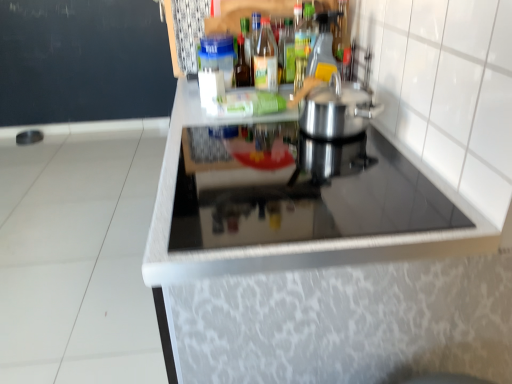
This screenshot has height=384, width=512. What are the coordinates of `vacant space to the left of clear glass bottle at upper center, which ranks as the third bottle in left-to-right order` in the screenshot? It's located at (226, 96).